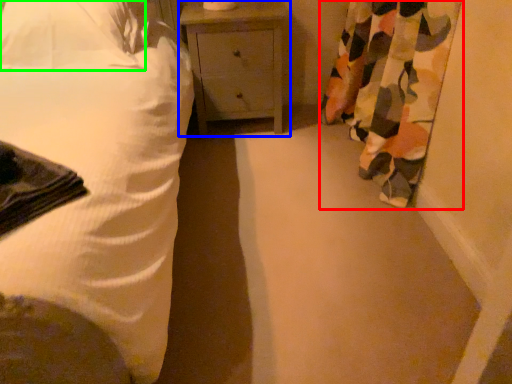
Question: Which is farther away from curtain (highlighted by a red box)? nightstand (highlighted by a blue box) or pillow (highlighted by a green box)?

Choices:
 (A) nightstand
 (B) pillow

Answer: (B)